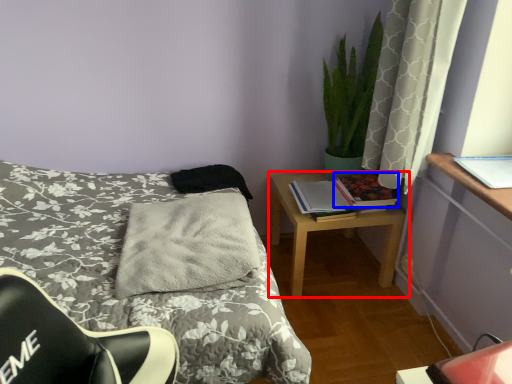
Question: Which point is further to the camera, nightstand (highlighted by a red box) or book (highlighted by a blue box)?

Choices:
 (A) nightstand
 (B) book

Answer: (B)